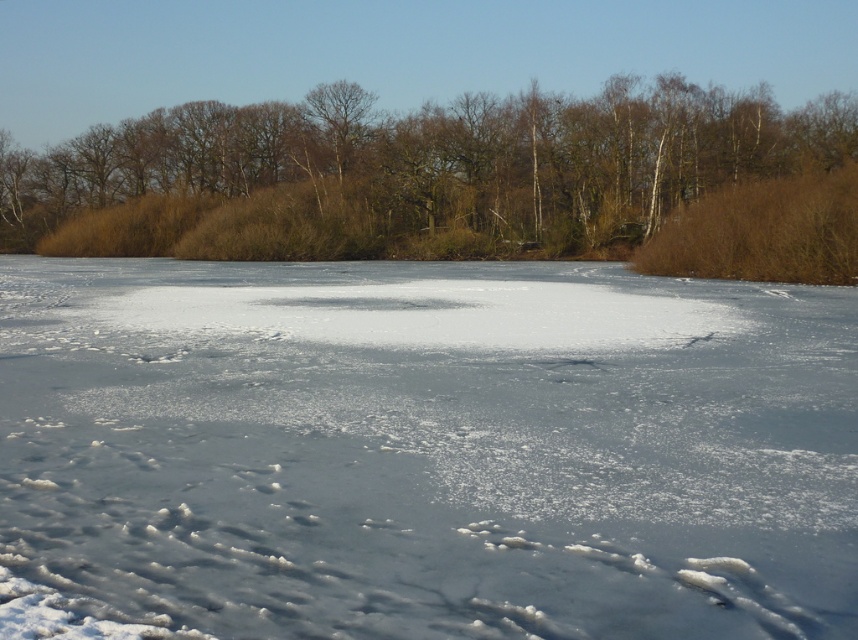
Question: Which of the following is the farthest from the observer?

Choices:
 (A) brown/dry grass at upper center
 (B) white frosty ice at center

Answer: (A)

Question: Which of the following is the farthest from the observer?

Choices:
 (A) (171, 113)
 (B) (490, 564)

Answer: (A)

Question: Is white frosty ice at center to the left of brown/dry grass at upper center from the viewer's perspective?

Choices:
 (A) no
 (B) yes

Answer: (A)

Question: Is white frosty ice at center wider than brown/dry grass at upper center?

Choices:
 (A) yes
 (B) no

Answer: (B)

Question: Is white frosty ice at center thinner than brown/dry grass at upper center?

Choices:
 (A) yes
 (B) no

Answer: (A)

Question: Which of the following is the closest to the observer?

Choices:
 (A) brown/dry grass at upper center
 (B) white frosty ice at center

Answer: (B)